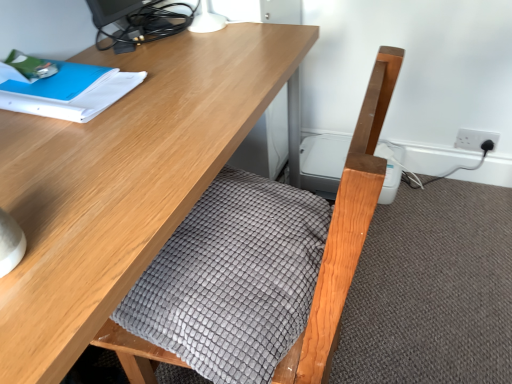
The image size is (512, 384). Identify the location of blank space situated above blue paper at upper left (from a real-world perspective). (54, 84).